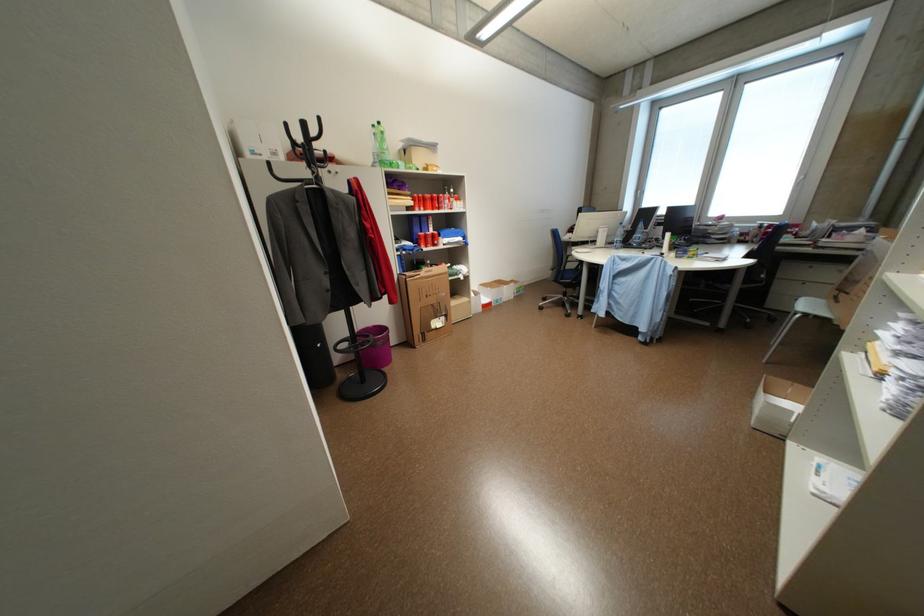
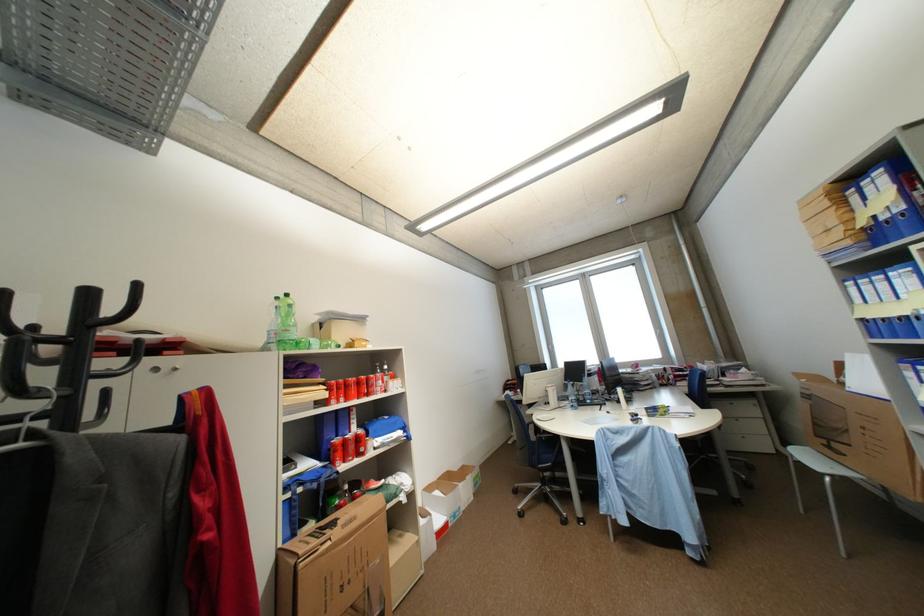
First-person continuous shooting, in which direction is the camera rotating?

The camera rotated toward right-up.